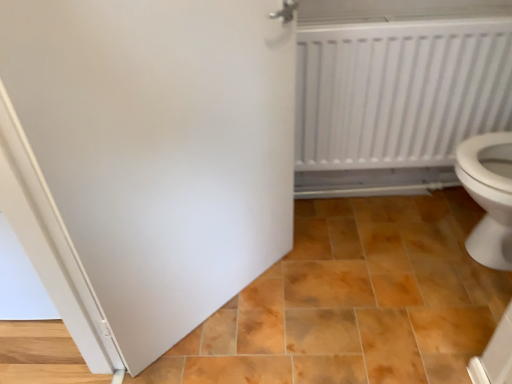
Question: Is brown glossy tile at center wider or thinner than white matte door at center?

Choices:
 (A) wide
 (B) thin

Answer: (A)

Question: Choose the correct answer: Is brown glossy tile at center inside white matte door at center or outside it?

Choices:
 (A) outside
 (B) inside

Answer: (A)

Question: Which object is the closest to the white matte door at center?

Choices:
 (A) brown glossy tile at center
 (B) white plastic radiator at upper right

Answer: (A)

Question: Based on their relative distances, which object is farther from the white matte door at center?

Choices:
 (A) white plastic radiator at upper right
 (B) brown glossy tile at center

Answer: (A)